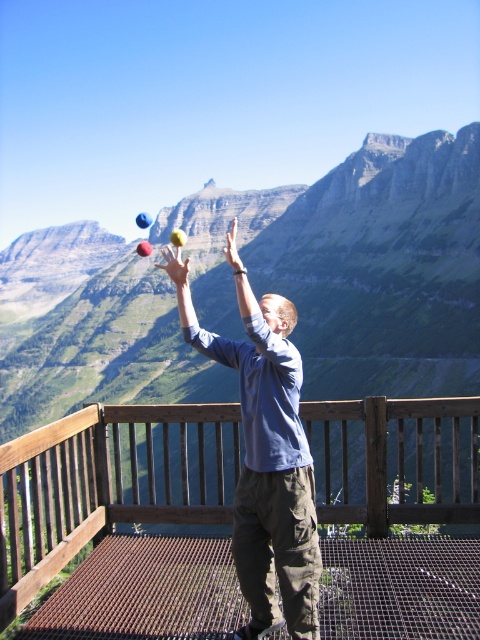
Based on the photo, you are an observer trying to take a photo of the scene. You want to ensure both the blue fabric shirt at center and the rubber ball at upper center are clearly visible. Which object should you focus on first to ensure it doesn t get blurred due to its size?

The blue fabric shirt at center occupies less space than the rubber ball at upper center, so you should focus on the rubber ball at upper center first because it is larger and requires more precise focus to avoid blurring.

You are a photographer trying to capture the entire scene of the green grassy mountain at upper center and the blue fabric shirt at center in one shot. Based on their sizes, which object should you focus on first to ensure both are in frame?

The green grassy mountain at upper center is bigger than the blue fabric shirt at center, so you should focus on the green grassy mountain at upper center first to ensure both are in frame.

You are a photographer trying to capture the blue fabric shirt at center and the brown wooden balustrade at center in a single shot. Based on their heights, which object will appear taller in the photo?

The brown wooden balustrade at center will appear taller in the photo since it has a greater height compared to the blue fabric shirt at center.